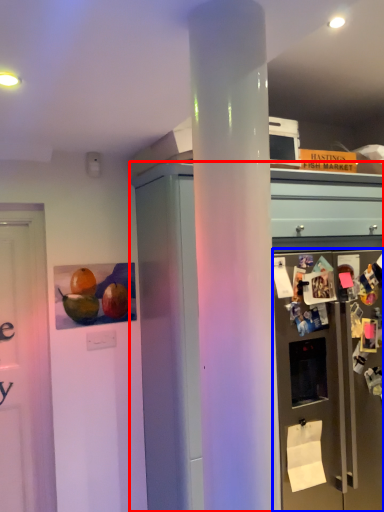
Question: Which object appears farthest to the camera in this image, cabinetry (highlighted by a red box) or refrigerator (highlighted by a blue box)?

Choices:
 (A) cabinetry
 (B) refrigerator

Answer: (B)